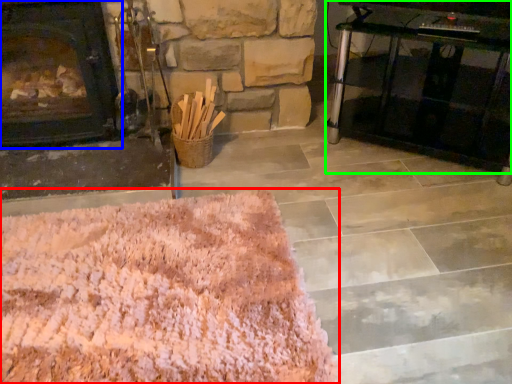
Question: Based on their relative distances, which object is farther from mat (highlighted by a red box)? Choose from fireplace (highlighted by a blue box) and table (highlighted by a green box).

Choices:
 (A) fireplace
 (B) table

Answer: (B)